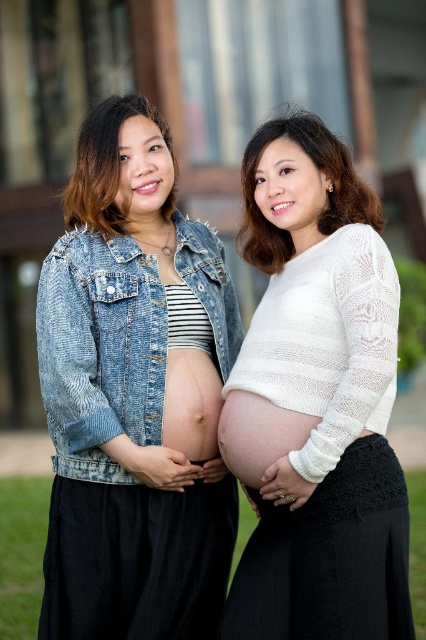
Question: Can you confirm if white knitted sweater at center is positioned to the right of matte skin at center?

Choices:
 (A) yes
 (B) no

Answer: (A)

Question: Can you confirm if faded denim jacket at lower right is wider than denim jacket at left?

Choices:
 (A) yes
 (B) no

Answer: (B)

Question: Which point is farther to the camera?

Choices:
 (A) faded denim jacket at lower right
 (B) white lace sweater at center
 (C) matte skin at center

Answer: (B)

Question: Which of these objects is positioned farthest from the white lace sweater at center?

Choices:
 (A) white knitted sweater at center
 (B) faded denim jacket at lower right
 (C) matte skin at center

Answer: (C)

Question: Based on their relative distances, which object is farther from the matte skin at center?

Choices:
 (A) faded denim jacket at lower right
 (B) white knitted sweater at center
 (C) denim jacket at left

Answer: (C)

Question: Can you confirm if faded denim jacket at lower right is bigger than matte skin at center?

Choices:
 (A) no
 (B) yes

Answer: (B)